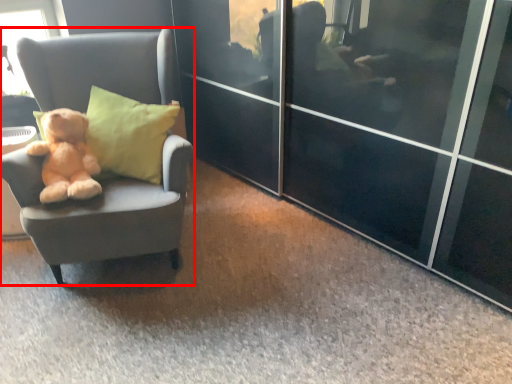
Question: From the image's perspective, what is the correct spatial relationship of chair (annotated by the red box) in relation to teddy bear?

Choices:
 (A) above
 (B) below

Answer: (A)